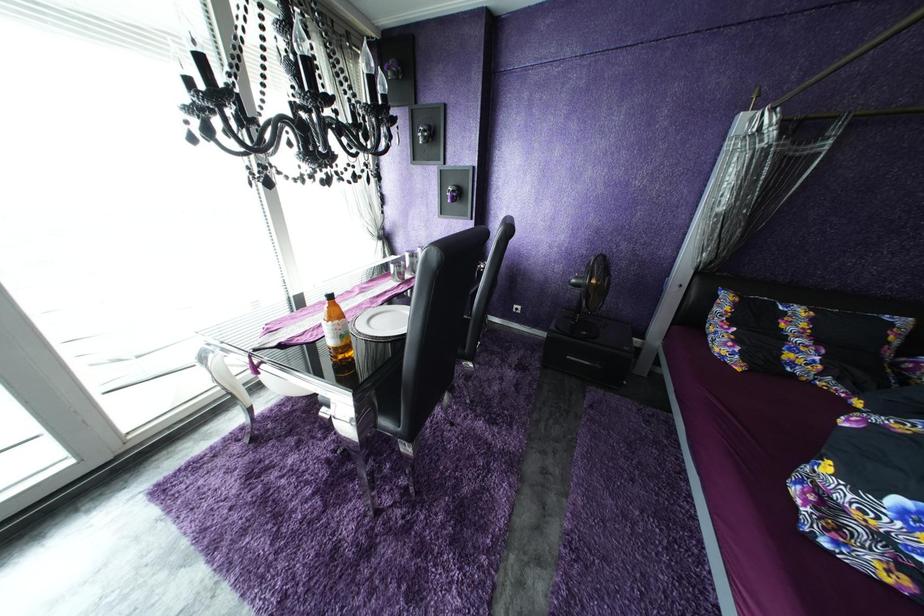
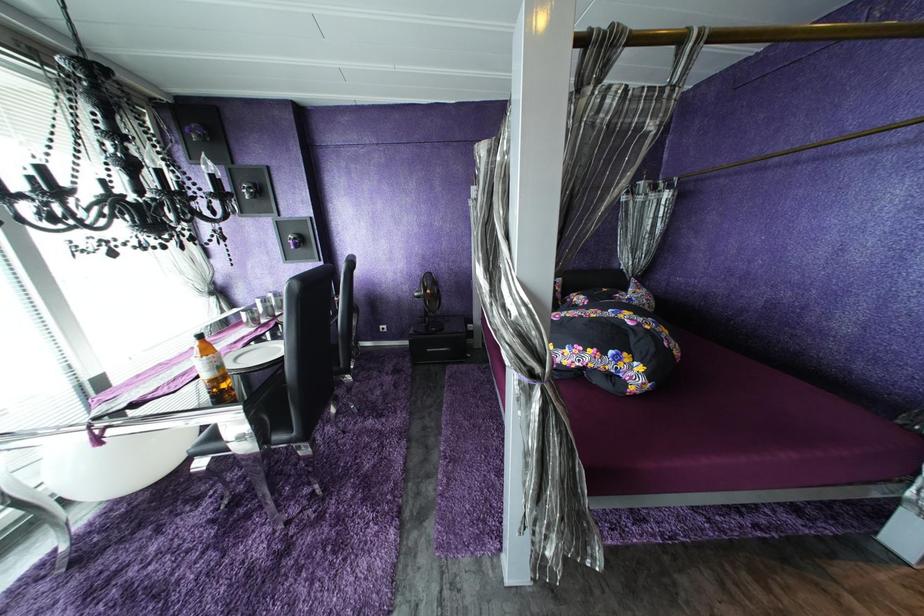
Question: The camera is either moving clockwise (left) or counter-clockwise (right) around the object. The first image is from the beginning of the video and the second image is from the end. Is the camera moving left or right when shooting the video?

Choices:
 (A) Left
 (B) Right

Answer: (A)